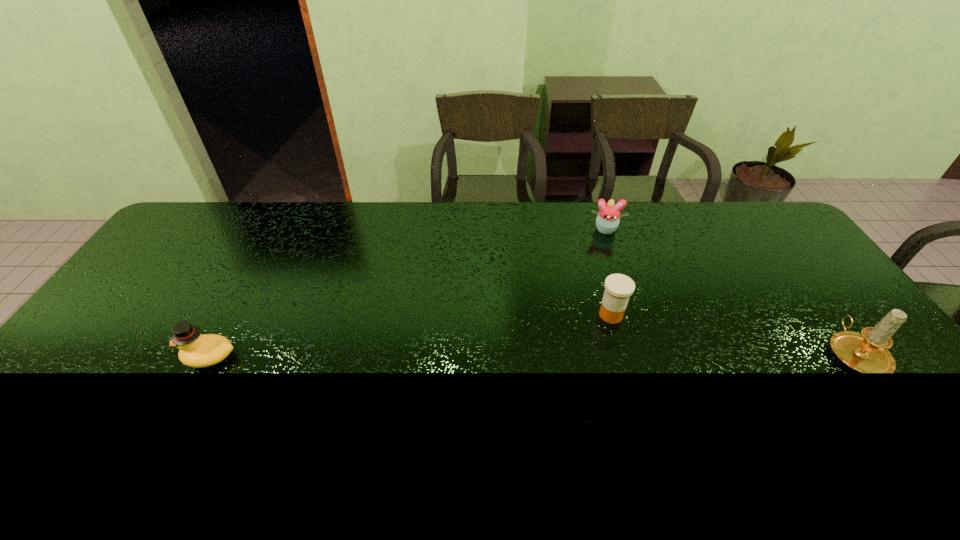
Locate an element on the screen. vacant space at the right edge of the desktop is located at coordinates (903, 385).

Locate an element on the screen. The width and height of the screenshot is (960, 540). blank space at the near left corner of the desktop is located at coordinates (56, 411).

The height and width of the screenshot is (540, 960). In the image, there is a desktop. Identify the location of free space at the far right corner. (755, 228).

Identify the location of free space between the medicine and the leftmost object. (411, 336).

The image size is (960, 540). In order to click on free space between the candle and the leftmost object in this screenshot , I will do `click(532, 355)`.

The image size is (960, 540). Identify the location of free space between the tallest object and the farthest object. (729, 291).

Locate an element on the screen. The width and height of the screenshot is (960, 540). empty space that is in between the leftmost object and the second farthest object is located at coordinates (411, 336).

You are a GUI agent. You are given a task and a screenshot of the screen. Output one action in this format:
    pyautogui.click(x=<x>, y=<y>)
    Task: Click on the vacant space that is in between the rightmost object and the leftmost object
    Image resolution: width=960 pixels, height=540 pixels.
    Given the screenshot: What is the action you would take?
    532,355

The height and width of the screenshot is (540, 960). Identify the location of vacant area that lies between the candle and the farthest object. (729, 291).

The height and width of the screenshot is (540, 960). What are the coordinates of `vacant region between the cupcake and the second farthest object` in the screenshot? It's located at (608, 272).